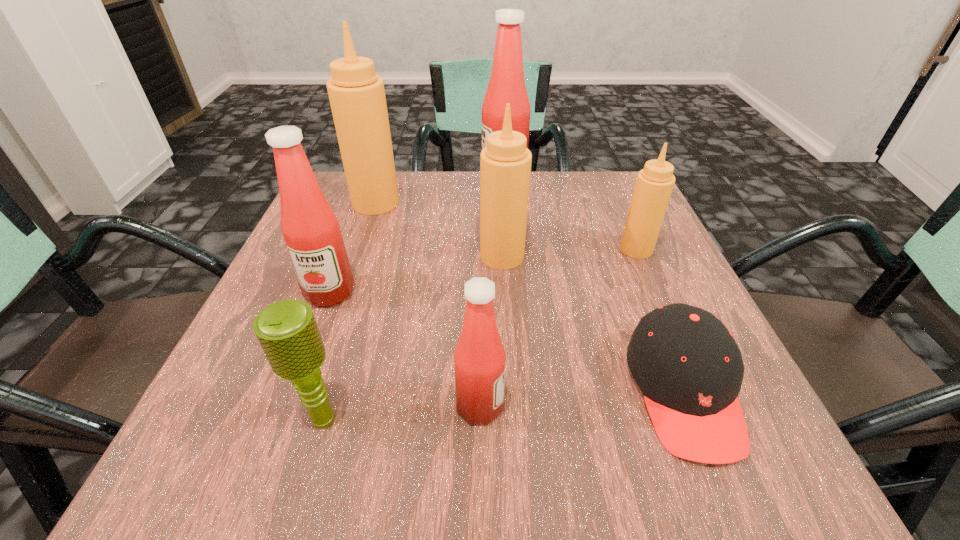
The height and width of the screenshot is (540, 960). In order to click on microphone in this screenshot , I will do `click(287, 331)`.

At what (x,y) coordinates should I click in order to perform the action: click on the shortest object. Please return your answer as a coordinate pair (x, y). The image size is (960, 540). Looking at the image, I should click on (687, 364).

This screenshot has width=960, height=540. In order to click on vacant space located 0.060m on the front-facing side of the farthest red condiment in this screenshot , I will do (x=457, y=184).

You are a GUI agent. You are given a task and a screenshot of the screen. Output one action in this format:
    pyautogui.click(x=<x>, y=<y>)
    Task: Click on the vacant region located on the front-facing side of the farthest red condiment
    
    Given the screenshot: What is the action you would take?
    pyautogui.click(x=400, y=184)

In order to click on vacant space located on the front-facing side of the farthest red condiment in this screenshot , I will do `click(380, 184)`.

Locate an element on the screen. This screenshot has height=540, width=960. vacant point located 0.060m on the front of the biggest tan condiment is located at coordinates (367, 231).

Where is `vacant space situated on the back of the second biggest tan condiment`? The width and height of the screenshot is (960, 540). vacant space situated on the back of the second biggest tan condiment is located at coordinates (499, 202).

Locate an element on the screen. vacant space located 0.100m on the front-facing side of the fifth farthest object is located at coordinates (306, 355).

At what (x,y) coordinates should I click in order to perform the action: click on vacant region located on the back of the smallest tan condiment. Please return your answer as a coordinate pair (x, y). The height and width of the screenshot is (540, 960). Looking at the image, I should click on (609, 186).

The image size is (960, 540). I want to click on free space located on the front-facing side of the smallest red condiment, so click(x=574, y=406).